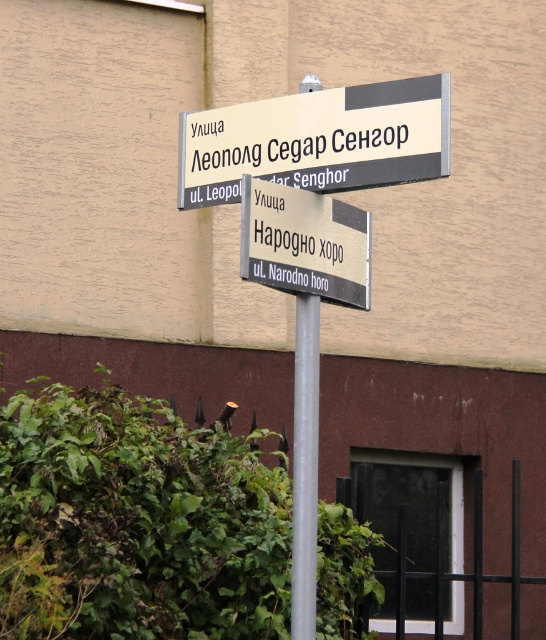
Does matte plastic street sign at upper center appear over metallic silver sign at center?

Correct, matte plastic street sign at upper center is located above metallic silver sign at center.

Describe the element at coordinates (317, 140) in the screenshot. Image resolution: width=546 pixels, height=640 pixels. I see `matte plastic street sign at upper center` at that location.

Where is `matte plastic street sign at upper center`? This screenshot has width=546, height=640. matte plastic street sign at upper center is located at coordinates (317, 140).